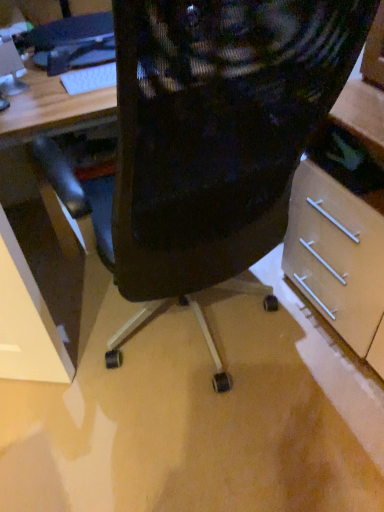
Question: From the image's perspective, is black plastic keyboard at upper left over matte black monitor at upper left?

Choices:
 (A) no
 (B) yes

Answer: (B)

Question: Can you confirm if black plastic keyboard at upper left is shorter than matte black monitor at upper left?

Choices:
 (A) yes
 (B) no

Answer: (A)

Question: Does black plastic keyboard at upper left touch matte black monitor at upper left?

Choices:
 (A) yes
 (B) no

Answer: (B)

Question: Is black plastic keyboard at upper left oriented towards matte black monitor at upper left?

Choices:
 (A) yes
 (B) no

Answer: (B)

Question: Is matte black monitor at upper left completely or partially inside black plastic keyboard at upper left?

Choices:
 (A) no
 (B) yes

Answer: (A)

Question: From a real-world perspective, relative to black mesh chair at center, is matte black monitor at upper left vertically above or below?

Choices:
 (A) below
 (B) above

Answer: (B)

Question: In the image, is matte black monitor at upper left positioned in front of or behind black mesh chair at center?

Choices:
 (A) behind
 (B) front

Answer: (A)

Question: Choose the correct answer: Is matte black monitor at upper left inside black mesh chair at center or outside it?

Choices:
 (A) outside
 (B) inside

Answer: (A)

Question: Is point (3, 83) closer or farther from the camera than point (185, 53)?

Choices:
 (A) farther
 (B) closer

Answer: (A)

Question: Considering the positions of black plastic keyboard at upper left and matte black monitor at upper left in the image, is black plastic keyboard at upper left wider or thinner than matte black monitor at upper left?

Choices:
 (A) thin
 (B) wide

Answer: (B)

Question: In the image, is black plastic keyboard at upper left on the left side or the right side of matte black monitor at upper left?

Choices:
 (A) left
 (B) right

Answer: (B)

Question: Is black plastic keyboard at upper left in front of or behind matte black monitor at upper left in the image?

Choices:
 (A) front
 (B) behind

Answer: (B)

Question: From a real-world perspective, is black plastic keyboard at upper left above or below matte black monitor at upper left?

Choices:
 (A) below
 (B) above

Answer: (A)

Question: Is black mesh chair at center inside or outside of matte black monitor at upper left?

Choices:
 (A) outside
 (B) inside

Answer: (A)

Question: In terms of size, does black mesh chair at center appear bigger or smaller than matte black monitor at upper left?

Choices:
 (A) small
 (B) big

Answer: (B)